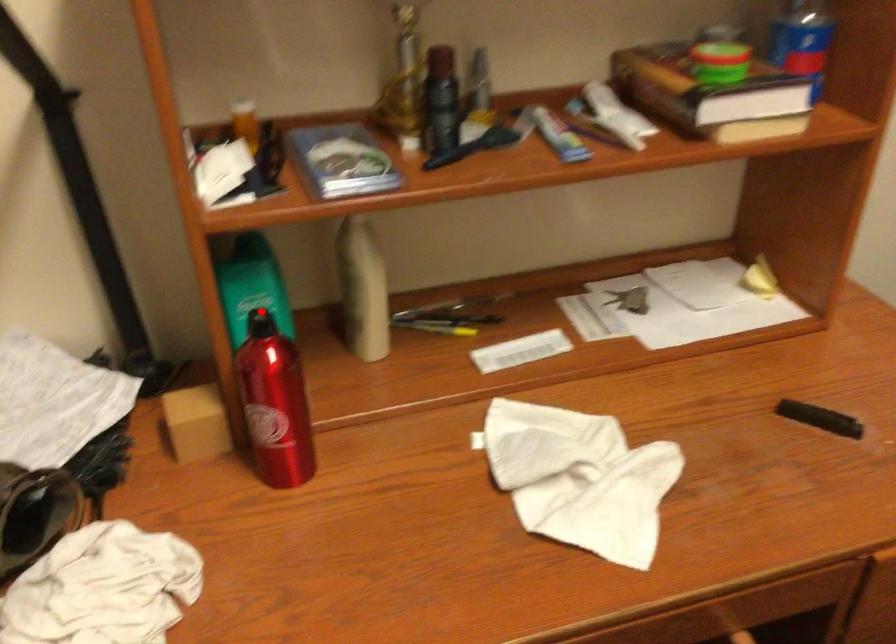
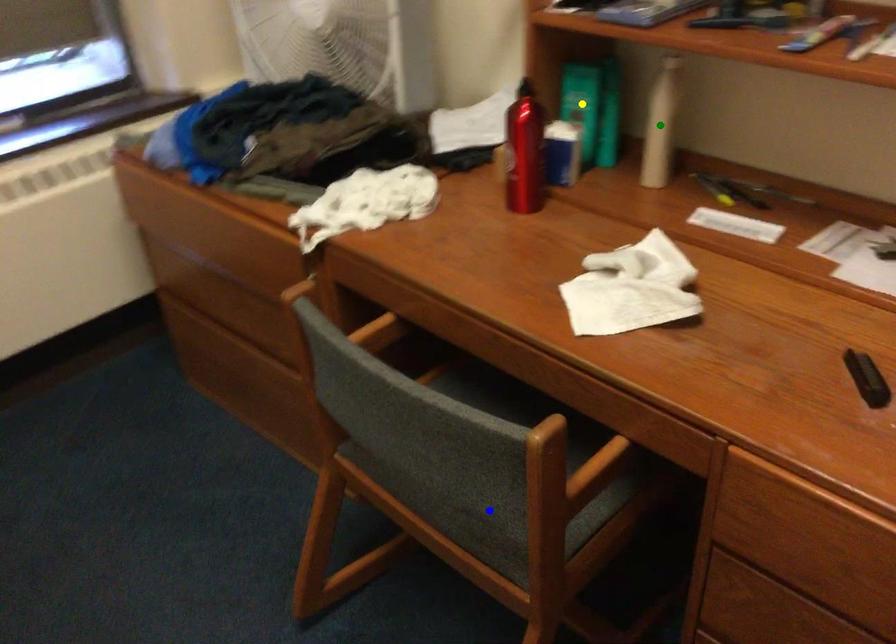
Question: I am providing you with two images of the same scene from different viewpoints. A red point is marked on the first image. You are given multiple points on the second image. Which mark in image 2 goes with the point in image 1?

Choices:
 (A) green point
 (B) yellow point
 (C) blue point

Answer: (B)